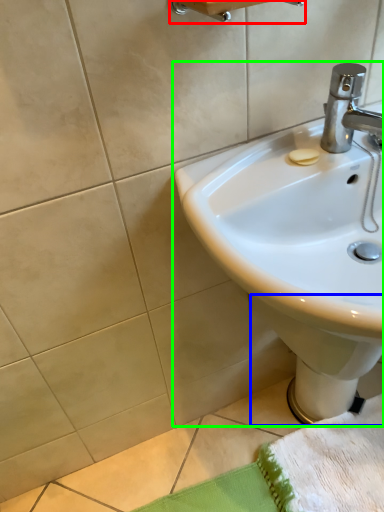
Question: Based on their relative distances, which object is nearer to towel bar (highlighted by a red box)? Choose from bidet (highlighted by a blue box) and sink (highlighted by a green box).

Choices:
 (A) bidet
 (B) sink

Answer: (B)